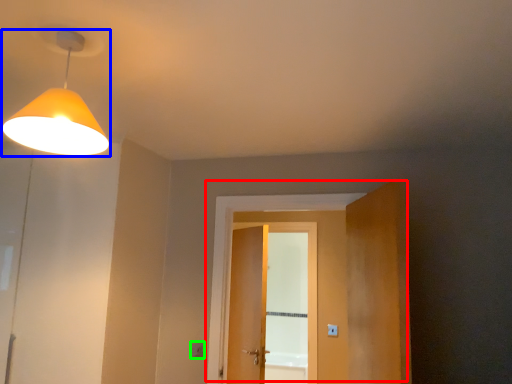
Question: Considering the real-world distances, which object is farthest from door (highlighted by a red box)? lamp (highlighted by a blue box) or light switch (highlighted by a green box)?

Choices:
 (A) lamp
 (B) light switch

Answer: (A)